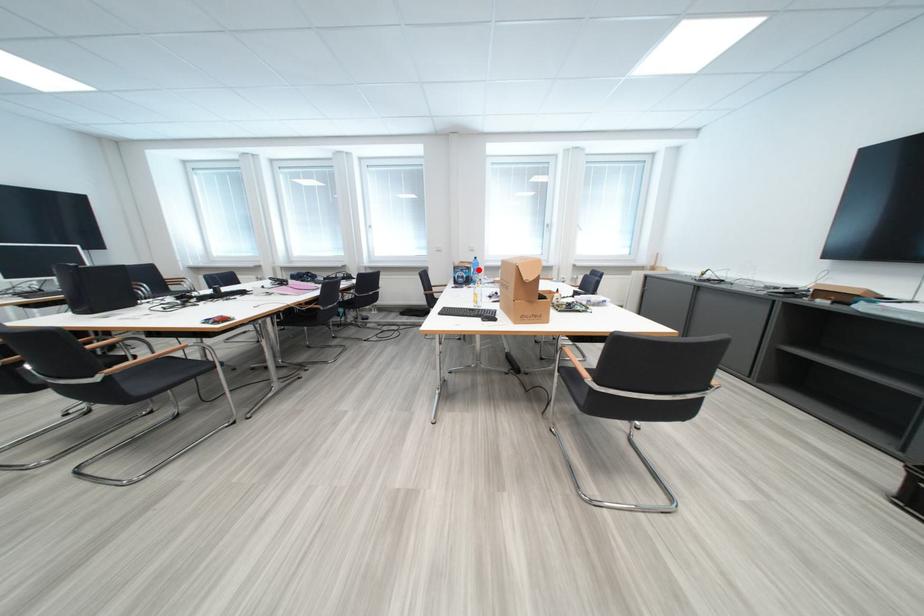
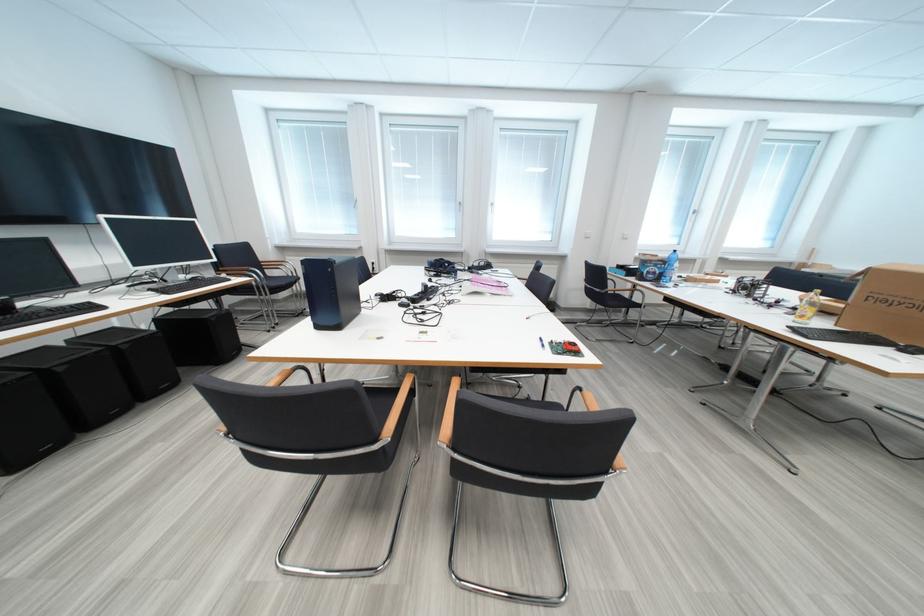
The point at the highlighted location is marked in the first image. Where is the corresponding point in the second image?

(675, 265)